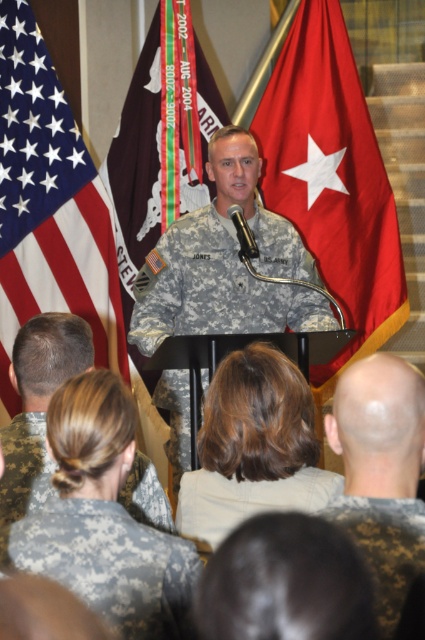
Based on the photo, you are attending a military event and notice the American flag at center and the camouflage uniform at center. According to the U.S. flag etiquette, which one should be placed to the right of the other?

The American flag at center should be placed to the right of the camouflage uniform at center because, according to U.S. flag etiquette, the U.S. flag should always be displayed to the right of other symbols or individuals when displayed together.

Based on the scene description, which object is larger in size between the american flag at upper left and the bald head at center?

The american flag at upper left is bigger than bald head at center.

Based on the photo, you are attending a military ceremony and notice the american flag at upper left and the bald head at center. Which one is taller?

The american flag at upper left is taller than the bald head at center.